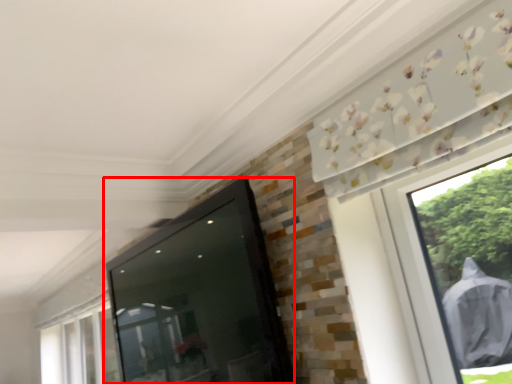
Question: From the image's perspective, considering the relative positions of screen door (annotated by the red box) and window in the image provided, where is screen door (annotated by the red box) located with respect to the staircase?

Choices:
 (A) below
 (B) above

Answer: (B)